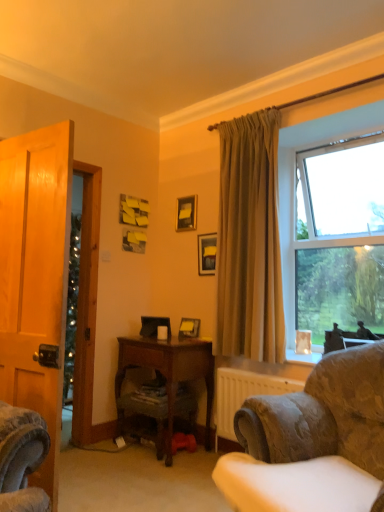
I want to click on vacant region to the left of wooden desk at center, so click(x=93, y=456).